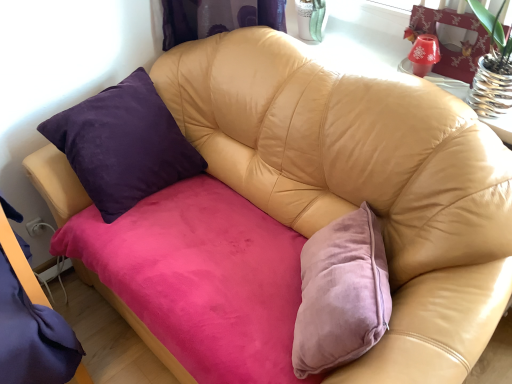
Question: From a real-world perspective, is purple velvet bed frame at left below translucent glass vase at upper right?

Choices:
 (A) no
 (B) yes

Answer: (B)

Question: Is the surface of purple velvet bed frame at left in direct contact with translucent glass vase at upper right?

Choices:
 (A) yes
 (B) no

Answer: (B)

Question: Can you confirm if purple velvet bed frame at left is taller than translucent glass vase at upper right?

Choices:
 (A) no
 (B) yes

Answer: (B)

Question: Could you tell me if purple velvet bed frame at left is turned towards translucent glass vase at upper right?

Choices:
 (A) yes
 (B) no

Answer: (B)

Question: Does purple velvet bed frame at left lie in front of translucent glass vase at upper right?

Choices:
 (A) no
 (B) yes

Answer: (B)

Question: From a real-world perspective, is purple velvet bed frame at left on top of translucent glass vase at upper right?

Choices:
 (A) no
 (B) yes

Answer: (A)

Question: Does translucent glass vase at upper right have a greater height compared to purple velvet bed frame at left?

Choices:
 (A) no
 (B) yes

Answer: (A)

Question: Does translucent glass vase at upper right have a lesser width compared to purple velvet bed frame at left?

Choices:
 (A) no
 (B) yes

Answer: (B)

Question: Is translucent glass vase at upper right wider than purple velvet bed frame at left?

Choices:
 (A) no
 (B) yes

Answer: (A)

Question: Is translucent glass vase at upper right closer to the viewer compared to purple velvet bed frame at left?

Choices:
 (A) yes
 (B) no

Answer: (B)

Question: From a real-world perspective, is translucent glass vase at upper right located higher than purple velvet bed frame at left?

Choices:
 (A) yes
 (B) no

Answer: (A)

Question: From a real-world perspective, is translucent glass vase at upper right physically below purple velvet bed frame at left?

Choices:
 (A) yes
 (B) no

Answer: (B)

Question: Relative to translucent glass vase at upper right, is purple velvet bed frame at left in front or behind?

Choices:
 (A) front
 (B) behind

Answer: (A)